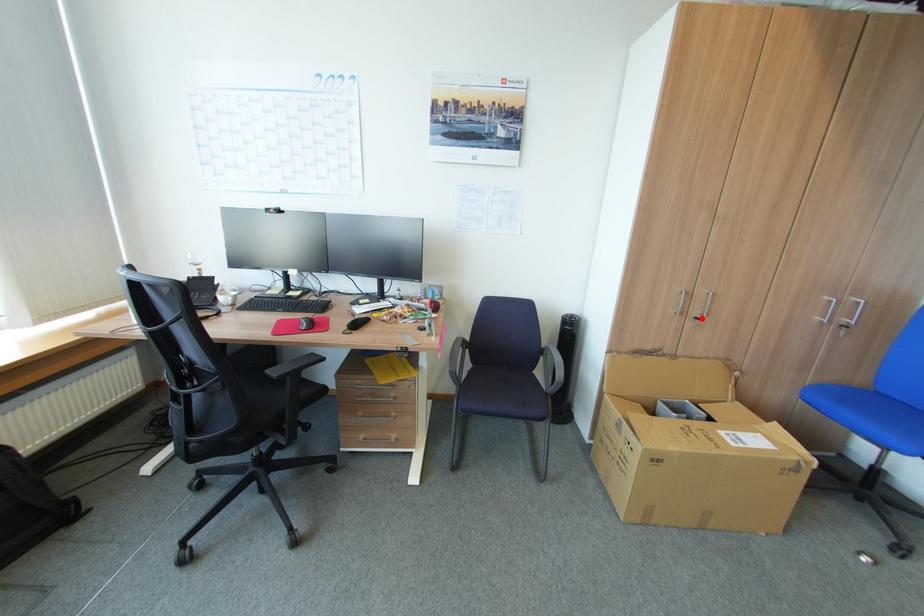
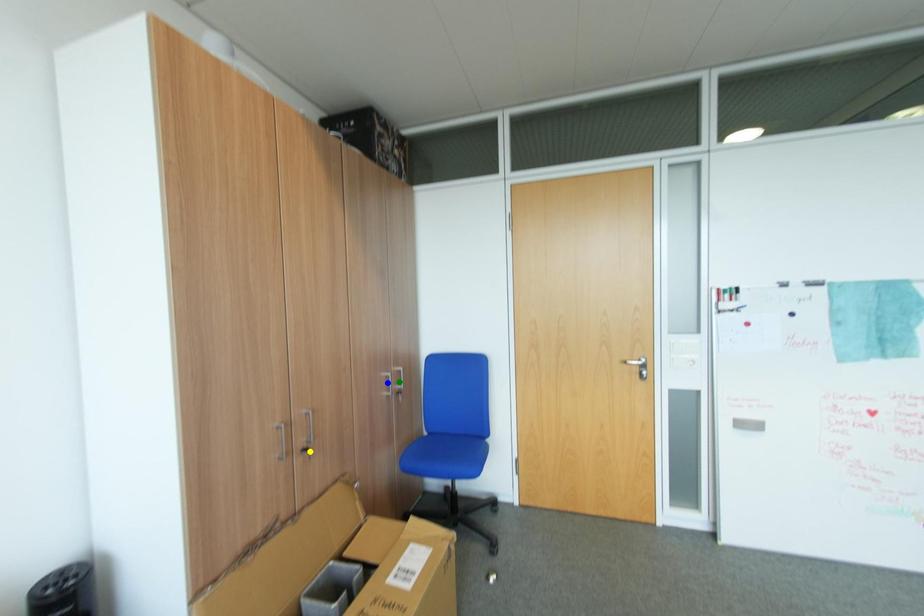
Question: I am providing you with two images of the same scene from different viewpoints. A red point is marked on the first image. You are given multiple points on the second image. Which point in image 2 represents the same 3d spot as the red point in image 1?

Choices:
 (A) green point
 (B) blue point
 (C) yellow point

Answer: (C)